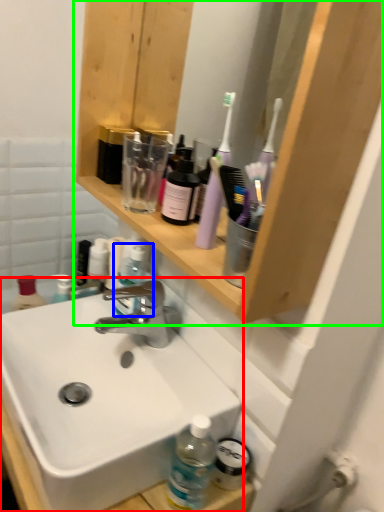
Question: Which object is positioned closest to sink (highlighted by a red box)? Select from bottle (highlighted by a blue box) and shelf (highlighted by a green box).

Choices:
 (A) bottle
 (B) shelf

Answer: (A)